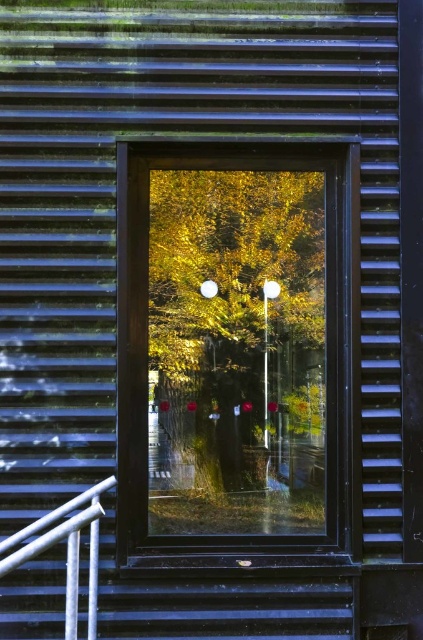
Question: Which point is farther to the camera?

Choices:
 (A) golden leafy tree at center
 (B) white glossy rail at lower left

Answer: (A)

Question: Can you confirm if golden leafy tree at center is wider than white glossy rail at lower left?

Choices:
 (A) no
 (B) yes

Answer: (B)

Question: Which of the following is the farthest from the observer?

Choices:
 (A) (288, 243)
 (B) (35, 525)

Answer: (A)

Question: Does golden leafy tree at center have a greater width compared to white glossy rail at lower left?

Choices:
 (A) no
 (B) yes

Answer: (B)

Question: Is golden leafy tree at center wider than white glossy rail at lower left?

Choices:
 (A) yes
 (B) no

Answer: (A)